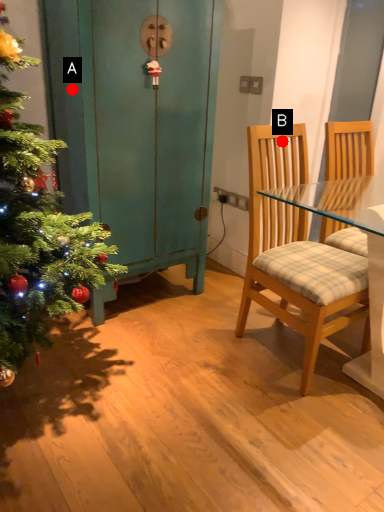
Question: Two points are circled on the image, labeled by A and B beside each circle. Which point is farther to the camera?

Choices:
 (A) A is further
 (B) B is further

Answer: (B)